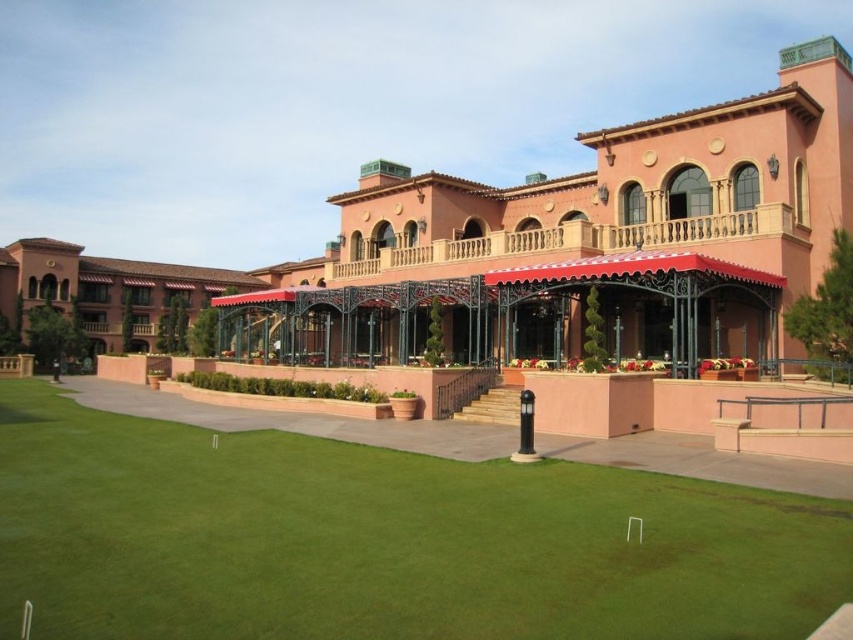
Question: Which point appears farthest from the camera in this image?

Choices:
 (A) (254, 493)
 (B) (218, 278)

Answer: (B)

Question: Does green grass at center appear under matte pink awning at center?

Choices:
 (A) no
 (B) yes

Answer: (B)

Question: Can you confirm if green grass at center is positioned below matte pink awning at center?

Choices:
 (A) no
 (B) yes

Answer: (B)

Question: Does green grass at center appear on the right side of matte pink awning at center?

Choices:
 (A) no
 (B) yes

Answer: (B)

Question: Among these points, which one is nearest to the camera?

Choices:
 (A) (120, 262)
 (B) (9, 506)

Answer: (B)

Question: Which point appears farthest from the camera in this image?

Choices:
 (A) (495, 460)
 (B) (105, 332)

Answer: (B)